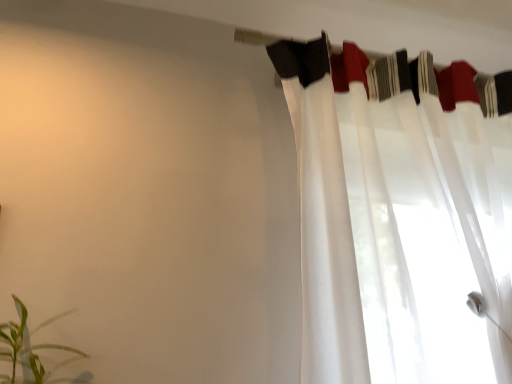
Question: From a real-world perspective, is white sheer curtain at upper right located beneath green leafy plant at lower left?

Choices:
 (A) yes
 (B) no

Answer: (B)

Question: Does white sheer curtain at upper right have a lesser height compared to green leafy plant at lower left?

Choices:
 (A) no
 (B) yes

Answer: (A)

Question: Can you confirm if white sheer curtain at upper right is smaller than green leafy plant at lower left?

Choices:
 (A) no
 (B) yes

Answer: (A)

Question: Are white sheer curtain at upper right and green leafy plant at lower left beside each other?

Choices:
 (A) yes
 (B) no

Answer: (B)

Question: From the image's perspective, is white sheer curtain at upper right located beneath green leafy plant at lower left?

Choices:
 (A) no
 (B) yes

Answer: (A)

Question: Is white sheer curtain at upper right bigger or smaller than white sheer fabric at upper center?

Choices:
 (A) small
 (B) big

Answer: (B)

Question: From a real-world perspective, relative to white sheer fabric at upper center, is white sheer curtain at upper right vertically above or below?

Choices:
 (A) below
 (B) above

Answer: (A)

Question: Is point [x=422, y=231] positioned closer to the camera than point [x=334, y=54]?

Choices:
 (A) farther
 (B) closer

Answer: (B)

Question: Is white sheer curtain at upper right to the left or to the right of white sheer fabric at upper center in the image?

Choices:
 (A) left
 (B) right

Answer: (B)

Question: From the image's perspective, relative to white sheer fabric at upper center, is green leafy plant at lower left above or below?

Choices:
 (A) below
 (B) above

Answer: (A)

Question: From a real-world perspective, is green leafy plant at lower left positioned above or below white sheer fabric at upper center?

Choices:
 (A) above
 (B) below

Answer: (B)

Question: Considering the positions of green leafy plant at lower left and white sheer fabric at upper center in the image, is green leafy plant at lower left bigger or smaller than white sheer fabric at upper center?

Choices:
 (A) small
 (B) big

Answer: (B)

Question: Considering the positions of point (82, 377) and point (396, 92), is point (82, 377) closer or farther from the camera than point (396, 92)?

Choices:
 (A) farther
 (B) closer

Answer: (B)

Question: Considering the positions of white sheer fabric at upper center and green leafy plant at lower left in the image, is white sheer fabric at upper center taller or shorter than green leafy plant at lower left?

Choices:
 (A) tall
 (B) short

Answer: (B)

Question: In terms of size, does white sheer fabric at upper center appear bigger or smaller than green leafy plant at lower left?

Choices:
 (A) big
 (B) small

Answer: (B)